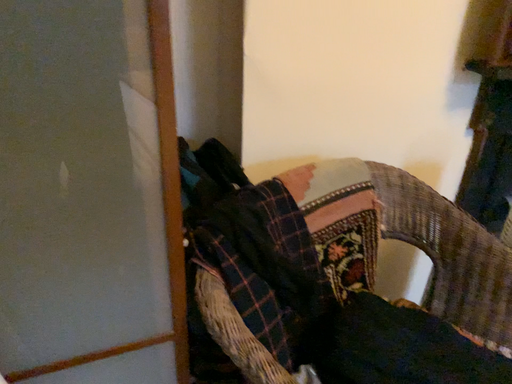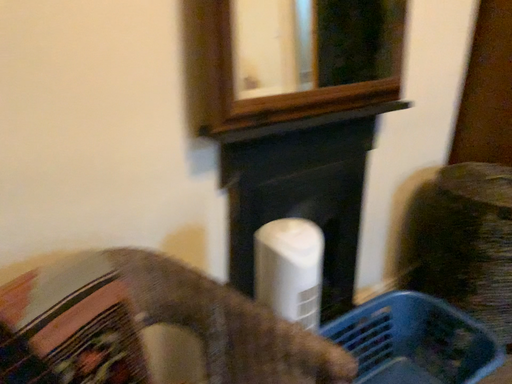
Question: How did the camera likely rotate when shooting the video?

Choices:
 (A) rotated left
 (B) rotated right

Answer: (B)